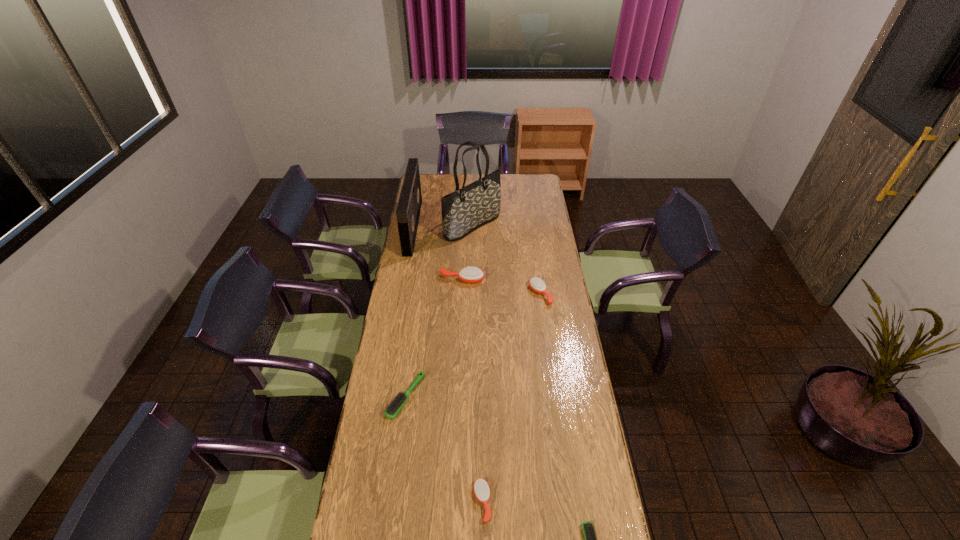
Find the location of a particular element. the smallest orange hairbrush is located at coordinates (481, 488).

Locate an element on the screen. Image resolution: width=960 pixels, height=540 pixels. blank space located 0.060m on the left of the tote bag is located at coordinates (434, 226).

This screenshot has height=540, width=960. In order to click on vacant area situated 0.180m on the front side of the sixth shortest object in this screenshot , I will do `click(449, 227)`.

Find the location of a particular element. blank space located on the back of the tallest hairbrush is located at coordinates (463, 267).

Find the location of `free space located on the back of the second tallest hairbrush`. free space located on the back of the second tallest hairbrush is located at coordinates (532, 233).

The height and width of the screenshot is (540, 960). Identify the location of vacant area situated on the front of the left light hairbrush. (391, 509).

Locate an element on the screen. The width and height of the screenshot is (960, 540). free location located on the back of the smallest orange hairbrush is located at coordinates point(482,416).

Image resolution: width=960 pixels, height=540 pixels. Identify the location of videotape at the left edge. (408, 209).

Where is `hairbrush at the left edge`? hairbrush at the left edge is located at coordinates (398, 401).

You are a GUI agent. You are given a task and a screenshot of the screen. Output one action in this format:
    pyautogui.click(x=<x>, y=<y>)
    Task: Click on the object positioned at the right edge
    
    Given the screenshot: What is the action you would take?
    pyautogui.click(x=536, y=284)